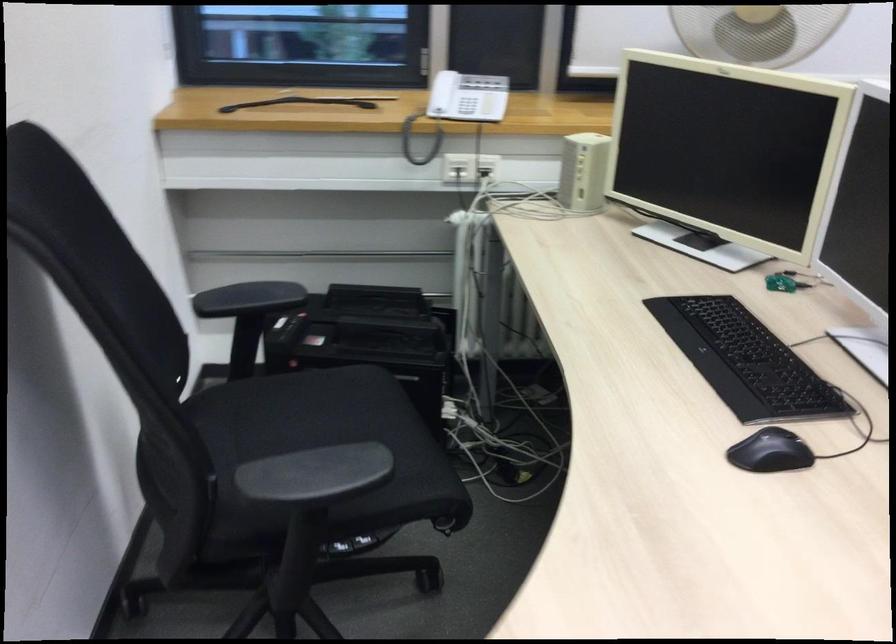
The image size is (896, 644). I want to click on black chair sitting surface, so click(309, 408).